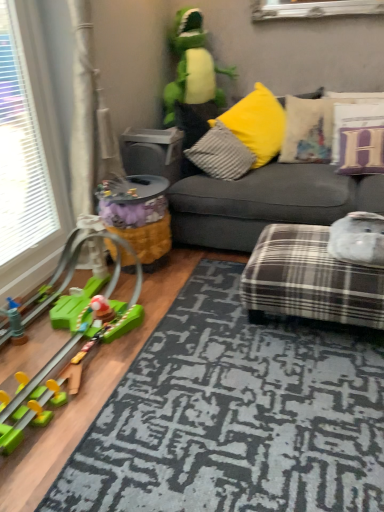
Question: Could yellow fabric toy at center, which is counted as the 2th toy, starting from the top, be considered to be inside velvet beige pillow at upper right, positioned as the 2th pillow in right-to-left order?

Choices:
 (A) yes
 (B) no

Answer: (B)

Question: Is velvet beige pillow at upper right, the second pillow viewed from the left, beside yellow fabric toy at center, which is counted as the 2th toy, starting from the top?

Choices:
 (A) yes
 (B) no

Answer: (B)

Question: From a real-world perspective, is velvet beige pillow at upper right, the second pillow viewed from the left, beneath yellow fabric toy at center, placed as the second toy when sorted from bottom to top?

Choices:
 (A) no
 (B) yes

Answer: (A)

Question: Can you confirm if velvet beige pillow at upper right, the second pillow viewed from the left, is taller than yellow fabric toy at center, which is counted as the 2th toy, starting from the top?

Choices:
 (A) yes
 (B) no

Answer: (B)

Question: From a real-world perspective, is velvet beige pillow at upper right, positioned as the 2th pillow in right-to-left order, located higher than yellow fabric toy at center, placed as the second toy when sorted from bottom to top?

Choices:
 (A) no
 (B) yes

Answer: (B)

Question: Looking at their shapes, would you say yellow fabric toy at center, placed as the second toy when sorted from bottom to top, is wider or thinner than white plastic window at left?

Choices:
 (A) wide
 (B) thin

Answer: (A)

Question: Based on their positions, is yellow fabric toy at center, which is counted as the 2th toy, starting from the top, located to the left or right of white plastic window at left?

Choices:
 (A) left
 (B) right

Answer: (B)

Question: From a real-world perspective, is yellow fabric toy at center, which is counted as the 2th toy, starting from the top, above or below white plastic window at left?

Choices:
 (A) below
 (B) above

Answer: (A)

Question: Considering the positions of point (125, 196) and point (13, 144), is point (125, 196) closer or farther from the camera than point (13, 144)?

Choices:
 (A) farther
 (B) closer

Answer: (A)

Question: Is white plastic window at left situated inside velvet beige pillow at upper right, the second pillow viewed from the left, or outside?

Choices:
 (A) outside
 (B) inside

Answer: (A)

Question: In the image, is white plastic window at left positioned in front of or behind velvet beige pillow at upper right, positioned as the 2th pillow in right-to-left order?

Choices:
 (A) front
 (B) behind

Answer: (A)

Question: Looking at their shapes, would you say white plastic window at left is wider or thinner than velvet beige pillow at upper right, positioned as the 2th pillow in right-to-left order?

Choices:
 (A) wide
 (B) thin

Answer: (B)

Question: From a real-world perspective, is white plastic window at left positioned above or below velvet beige pillow at upper right, positioned as the 2th pillow in right-to-left order?

Choices:
 (A) above
 (B) below

Answer: (A)

Question: From the image's perspective, is plaid fabric ottoman at lower right, positioned as the 2th studio couch in top-to-bottom order, above or below gray fabric couch at center, the 2th studio couch in the bottom-to-top sequence?

Choices:
 (A) below
 (B) above

Answer: (A)

Question: In terms of height, does plaid fabric ottoman at lower right, positioned as the 2th studio couch in top-to-bottom order, look taller or shorter compared to gray fabric couch at center, the 2th studio couch in the bottom-to-top sequence?

Choices:
 (A) short
 (B) tall

Answer: (A)